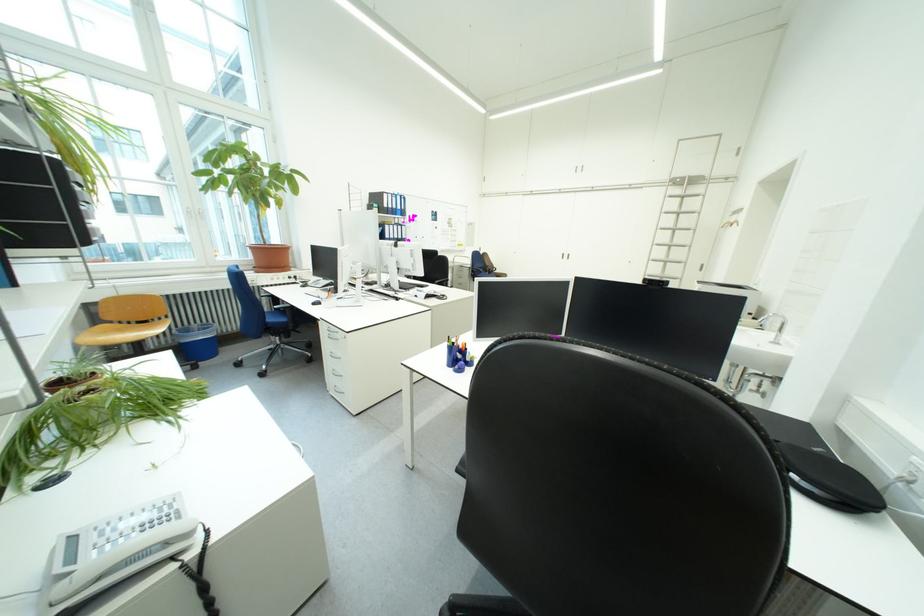
Describe the element at coordinates (120, 333) in the screenshot. The height and width of the screenshot is (616, 924). I see `a yellow chair sitting surface` at that location.